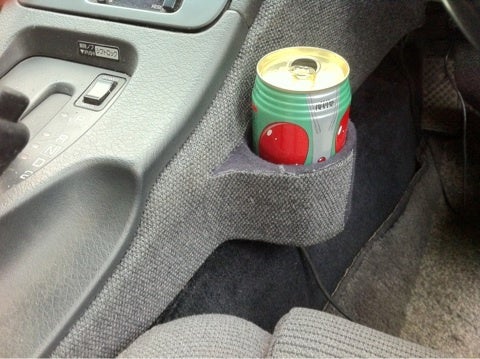
What are the coordinates of `cupholder` in the screenshot? It's located at [333, 211].